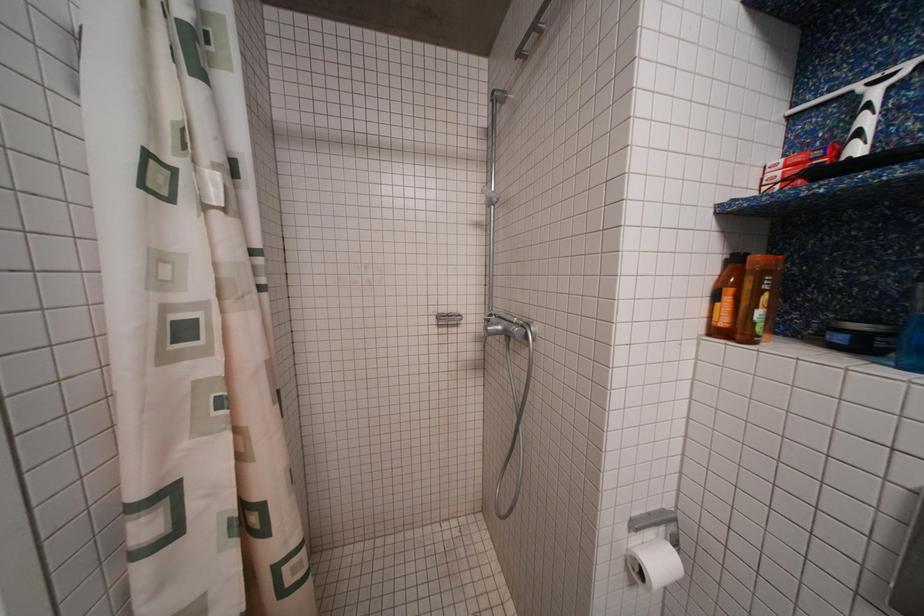
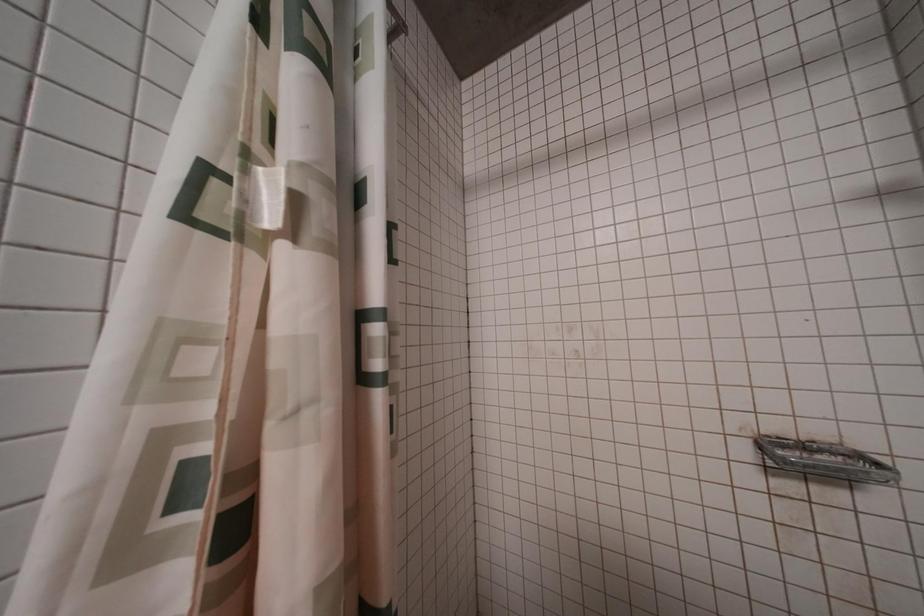
Question: The camera is either moving clockwise (left) or counter-clockwise (right) around the object. The first image is from the beginning of the video and the second image is from the end. Is the camera moving left or right when shooting the video?

Choices:
 (A) Left
 (B) Right

Answer: (B)